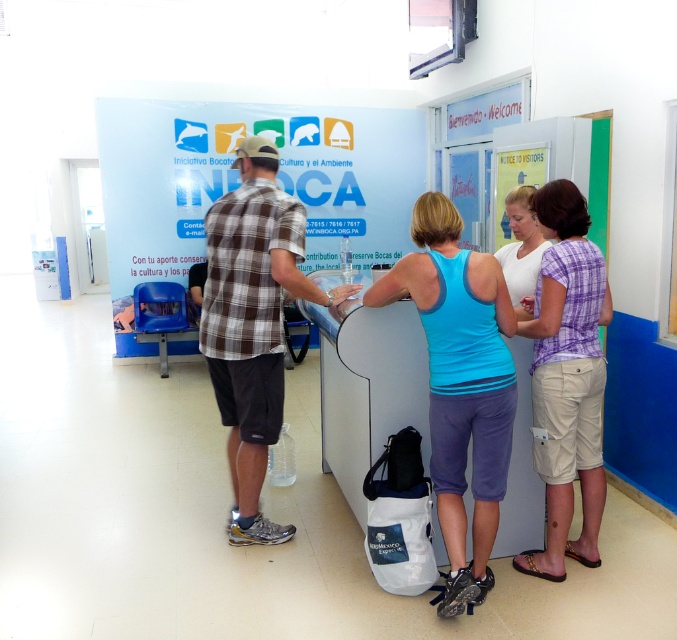
You are standing at the reception desk and need to locate the blue fabric tank top at center. According to the coordinates provided, where exactly is it positioned?

The blue fabric tank top at center is positioned at coordinates point 0.600 in the x axis and 0.681 in the y axis.

You are a fashion designer observing the two clothing items in the scene. The blue fabric tank top at center and the beige cotton shorts at center are part of a potential outfit. Can you determine if these two items can be worn together comfortably based on their spatial positioning?

The blue fabric tank top at center and the beige cotton shorts at center are 43.09 centimeters apart from each other, so they can be worn together comfortably as the distance between them allows for proper layering and movement.